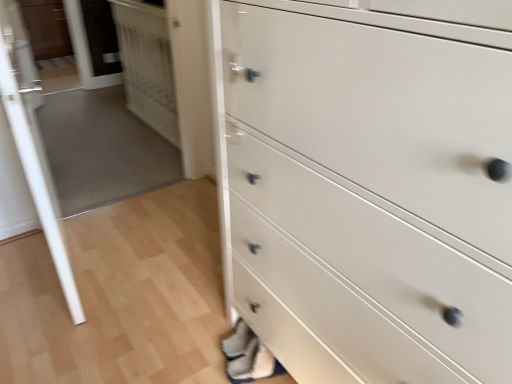
The height and width of the screenshot is (384, 512). What are the coordinates of `free space to the back side of transparent glass door at left, which appears as the 2th glass door when viewed from the back` in the screenshot? It's located at (124, 219).